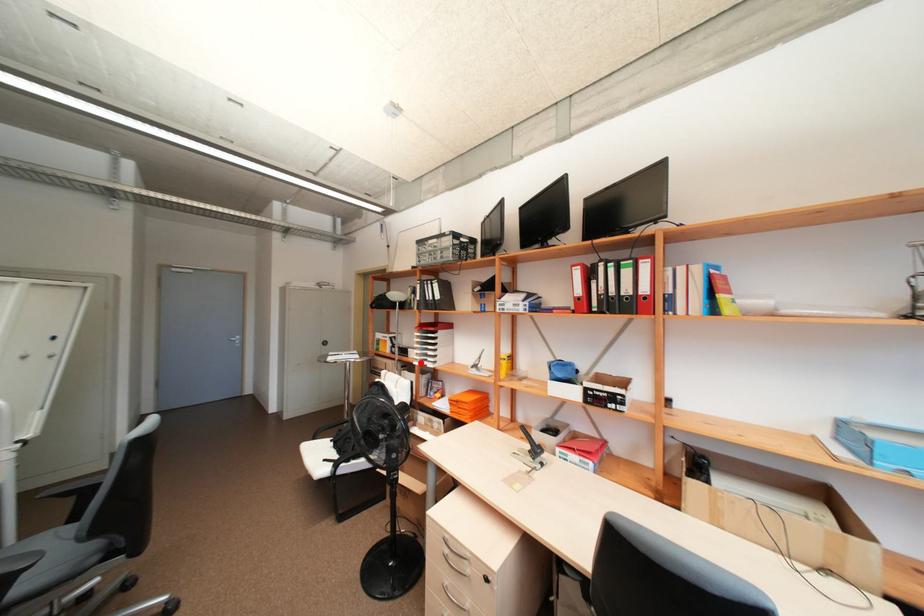
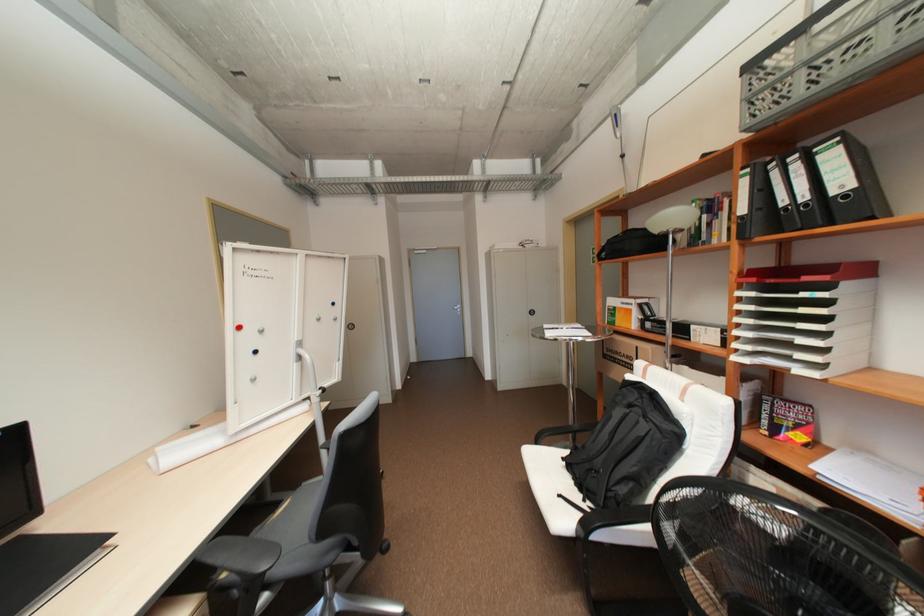
Question: I am providing you with two images of the same scene from different viewpoints. Image1 has a red point marked. In image2, the corresponding 3D location appears at what relative position? Reply with the corresponding letter.

Choices:
 (A) Closer
 (B) Farther

Answer: (A)